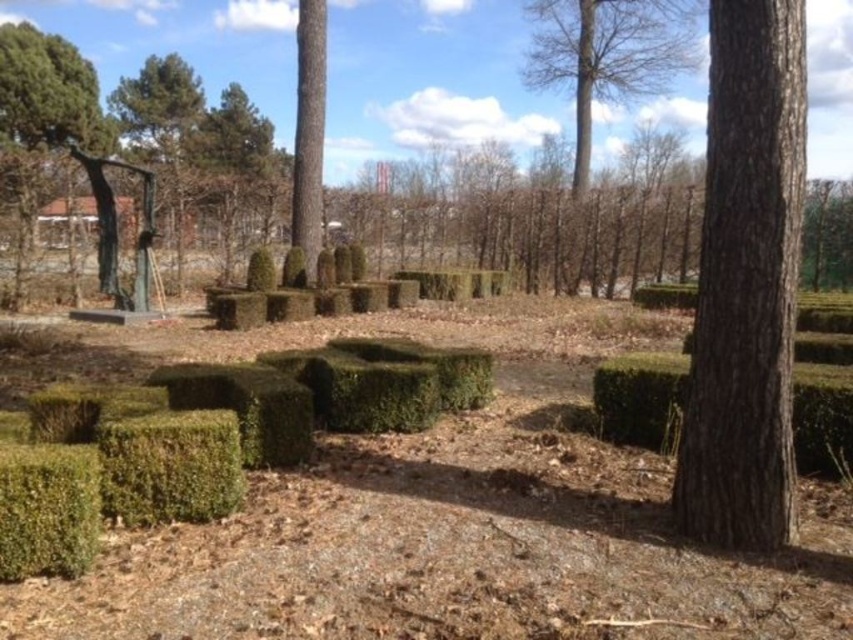
Is smooth bark tree at center above green leafy tree at upper right?

Indeed, smooth bark tree at center is positioned over green leafy tree at upper right.

Is point (294, 240) positioned before point (819, 218)?

Yes, point (294, 240) is closer to viewer.

Where is `smooth bark tree at center`? Image resolution: width=853 pixels, height=640 pixels. smooth bark tree at center is located at coordinates (309, 131).

This screenshot has height=640, width=853. What are the coordinates of `smooth bark tree at center` in the screenshot? It's located at (309, 131).

Who is taller, bare wood tree at upper center or green textured bush at lower left?

bare wood tree at upper center is taller.

Does point (637, 90) come closer to viewer compared to point (117, 458)?

No, it is not.

I want to click on bare wood tree at upper center, so click(x=608, y=54).

Which is above, brown rough bark tree at right or green leafy bush at lower left?

brown rough bark tree at right

Between brown rough bark tree at right and green leafy bush at lower left, which one has less height?

green leafy bush at lower left

Identify the location of brown rough bark tree at right. (746, 282).